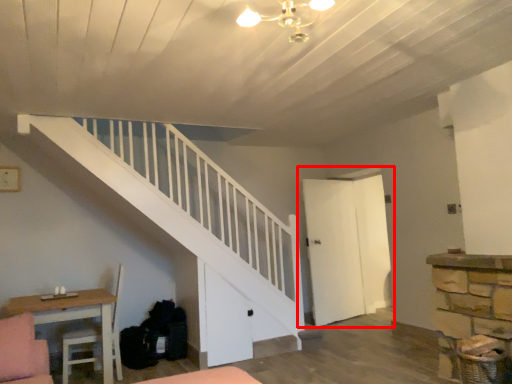
Question: Where is door (annotated by the red box) located in relation to table in the image?

Choices:
 (A) right
 (B) left

Answer: (A)